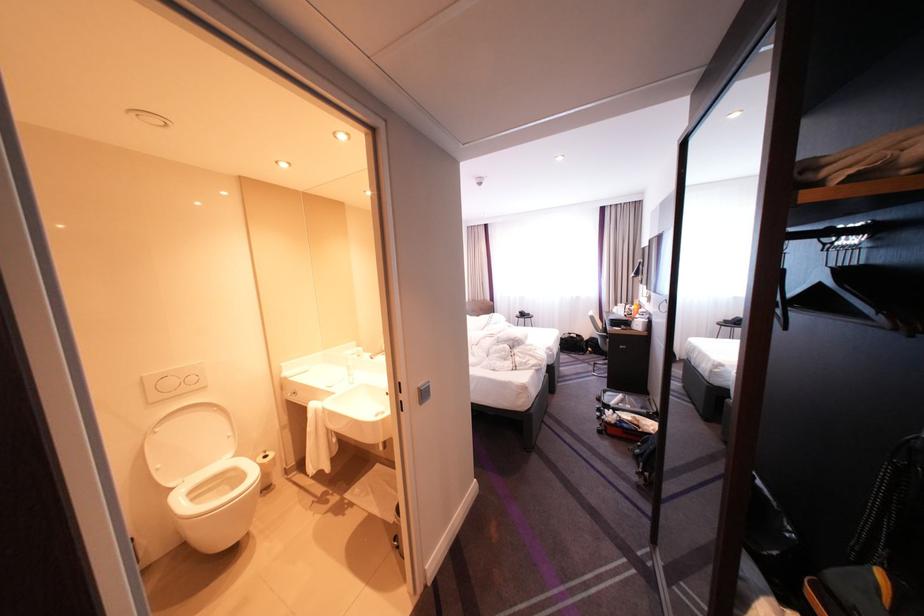
Image resolution: width=924 pixels, height=616 pixels. Identify the location of chair sitting surface. (602, 342).